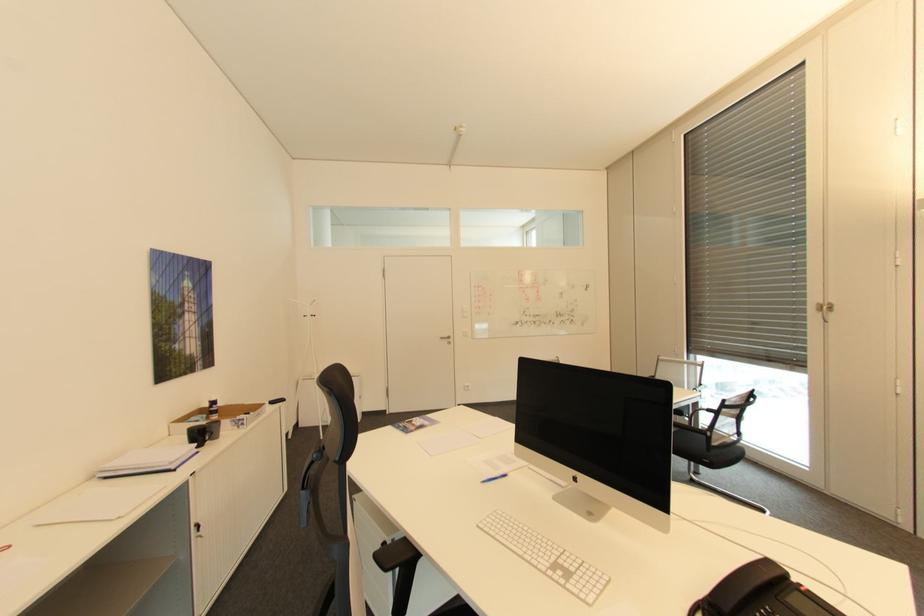
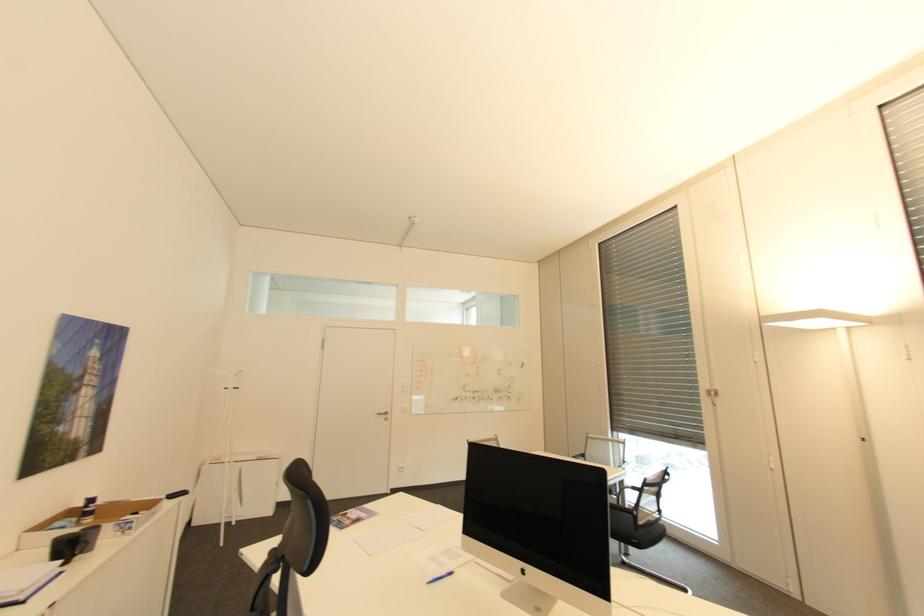
The point at (521, 454) is marked in the first image. Where is the corresponding point in the second image?

(468, 546)